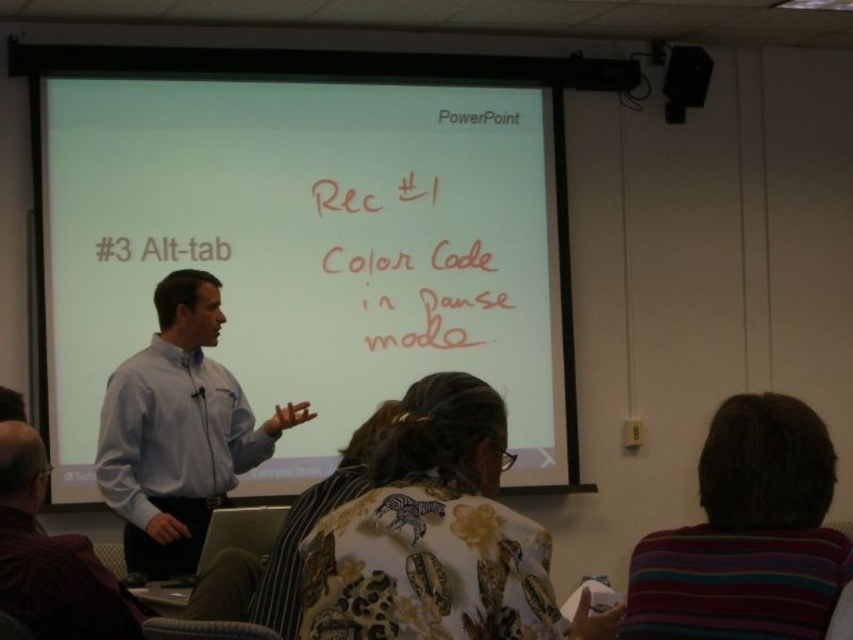
Question: Which point is closer to the camera taking this photo?

Choices:
 (A) (350, 204)
 (B) (495, 550)
 (C) (27, 465)

Answer: (B)

Question: Can you confirm if floral fabric shirt at center is positioned below red marker text at upper center?

Choices:
 (A) no
 (B) yes

Answer: (B)

Question: Does matte blue shirt at center have a smaller size compared to red marker text at upper center?

Choices:
 (A) yes
 (B) no

Answer: (A)

Question: Considering the real-world distances, which object is closest to the white matte projector screen at upper center?

Choices:
 (A) red marker text at upper center
 (B) light blue shirt at center
 (C) matte blue shirt at center
 (D) floral fabric shirt at center

Answer: (A)

Question: Which of the following is the farthest from the observer?

Choices:
 (A) (25, 593)
 (B) (467, 157)
 (C) (421, 620)
 (D) (271, 429)

Answer: (B)

Question: Considering the relative positions of white matte projector screen at upper center and matte blue shirt at center in the image provided, where is white matte projector screen at upper center located with respect to matte blue shirt at center?

Choices:
 (A) below
 (B) above

Answer: (B)